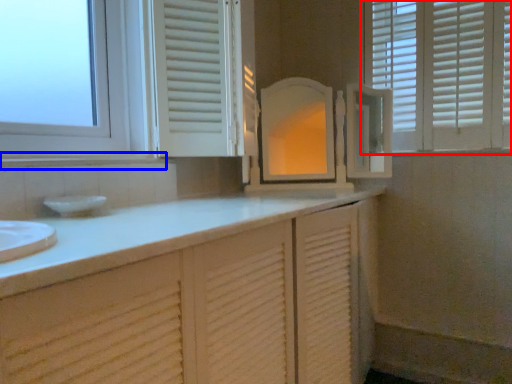
Question: Among these objects, which one is nearest to the camera, window (highlighted by a red box) or window sill (highlighted by a blue box)?

Choices:
 (A) window
 (B) window sill

Answer: (B)